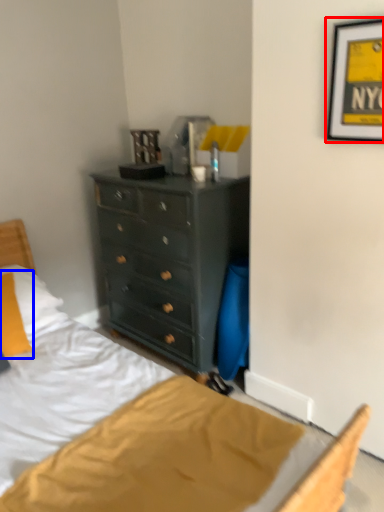
Question: Which point is further to the camera, picture frame (highlighted by a red box) or pillow (highlighted by a blue box)?

Choices:
 (A) picture frame
 (B) pillow

Answer: (B)